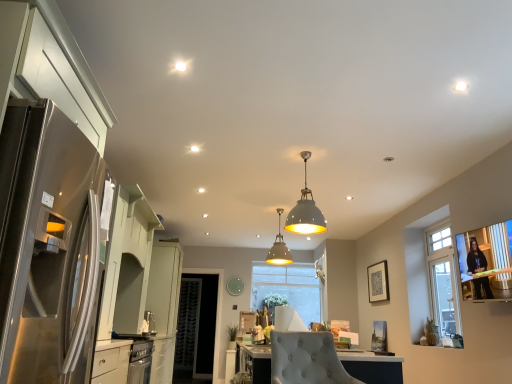
Question: Is matte gray pendant light at center, which is counted as the second lamp, starting from the front, bigger or smaller than white glossy countertop at lower left?

Choices:
 (A) small
 (B) big

Answer: (A)

Question: Looking at their shapes, would you say matte gray pendant light at center, which is counted as the second lamp, starting from the front, is wider or thinner than white glossy countertop at lower left?

Choices:
 (A) thin
 (B) wide

Answer: (A)

Question: Considering the real-world distances, which object is closest to the matte gray pendant light at center, which is counted as the second lamp, starting from the front?

Choices:
 (A) clear glass door at center
 (B) white glossy countertop at lower left
 (C) white matte pendant light at center, acting as the first lamp starting from the top
 (D) stainless steel refrigerator at left
 (E) clear glass window at center

Answer: (E)

Question: Estimate the real-world distances between objects in this image. Which object is farther from the clear glass door at center?

Choices:
 (A) white matte pendant light at center, positioned as the second lamp in back-to-front order
 (B) glass window screen at right
 (C) white glossy countertop at lower left
 (D) matte gray pendant light at center, which is counted as the second lamp, starting from the front
 (E) clear glass window at center

Answer: (B)